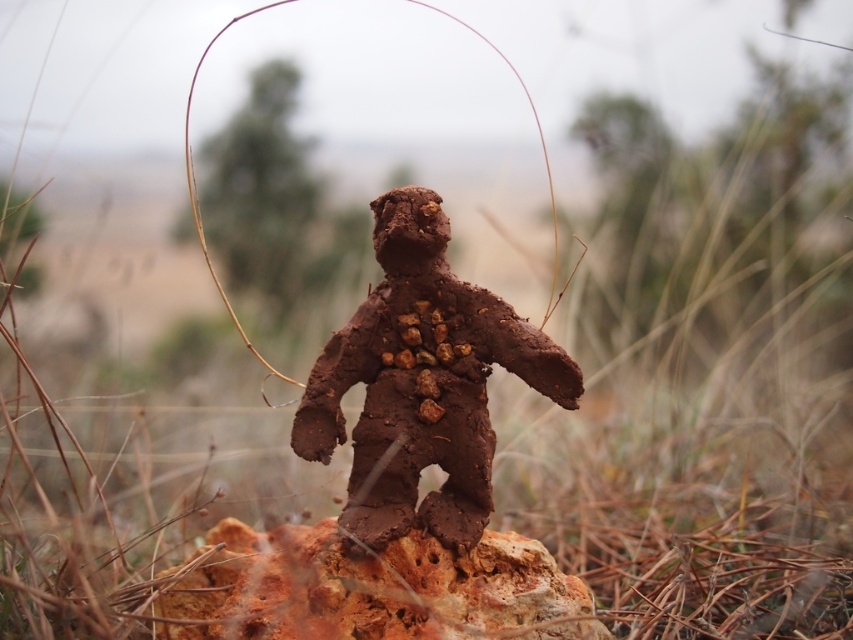
Question: Among these objects, which one is nearest to the camera?

Choices:
 (A) rusty rock at center
 (B) dull brown clay figure at center

Answer: (A)

Question: Can you confirm if dull brown clay figure at center is positioned to the left of rusty rock at center?

Choices:
 (A) no
 (B) yes

Answer: (A)

Question: Which point is closer to the camera?

Choices:
 (A) dull brown clay figure at center
 (B) rusty rock at center

Answer: (B)

Question: Can you confirm if dull brown clay figure at center is positioned to the left of rusty rock at center?

Choices:
 (A) yes
 (B) no

Answer: (B)

Question: Does dull brown clay figure at center have a smaller size compared to rusty rock at center?

Choices:
 (A) yes
 (B) no

Answer: (A)